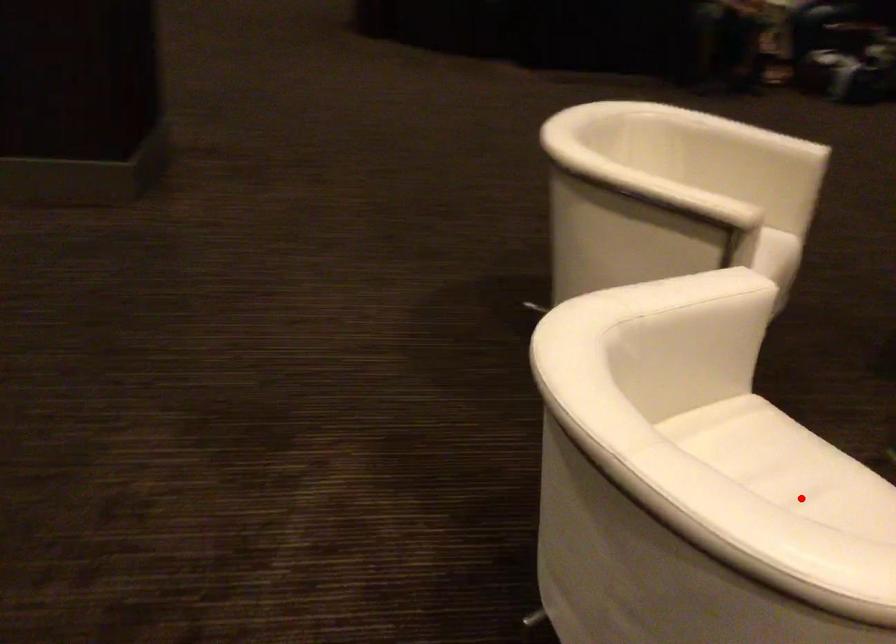
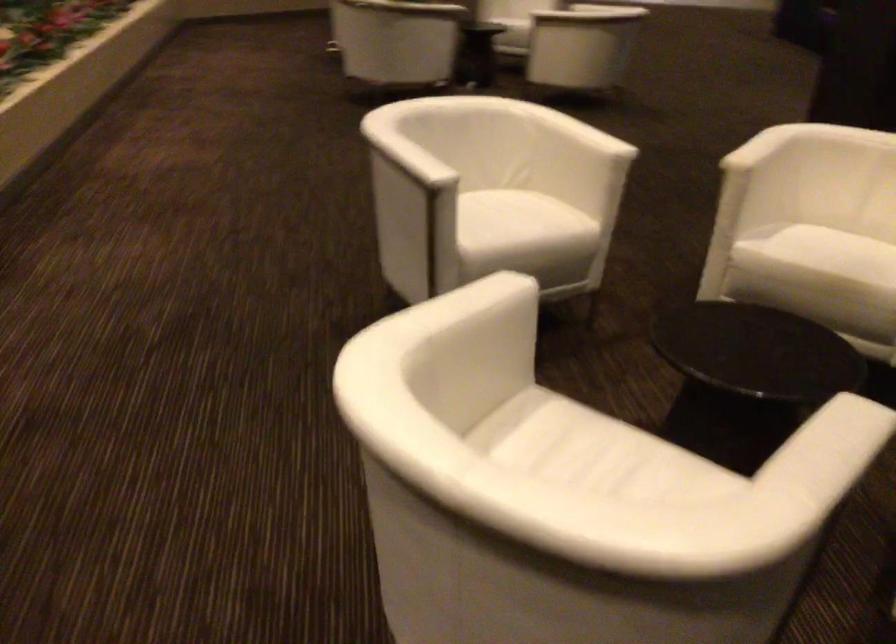
In the second image, find the point that corresponds to the highlighted location in the first image.

(502, 214)